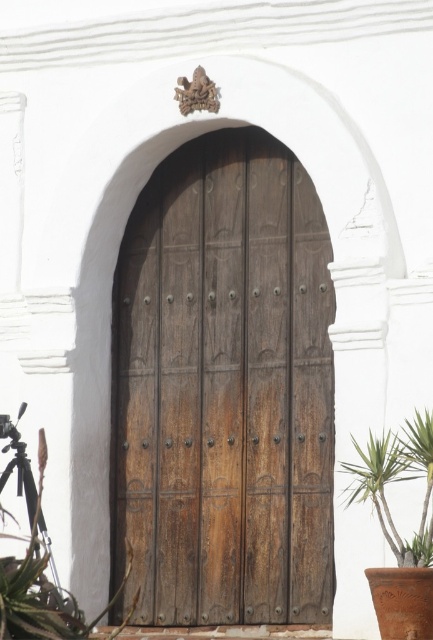
You are standing in front of the double doors of a historical building. You notice a brown wooden door at center and a green leafy plant at lower left. Which object is closer to you?

The brown wooden door at center is positioned over the green leafy plant at lower left, meaning it is closer to you.